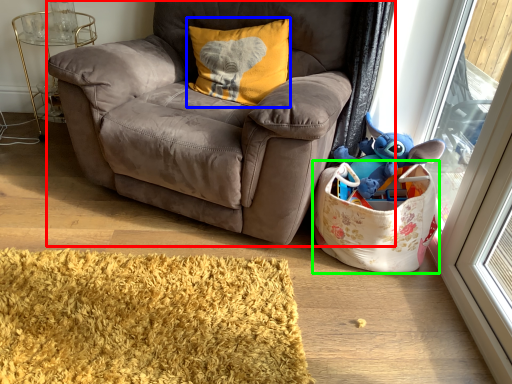
Question: Which object is the closest to the chair (highlighted by a red box)? Choose among these: pillow (highlighted by a blue box) or bag (highlighted by a green box).

Choices:
 (A) pillow
 (B) bag

Answer: (A)